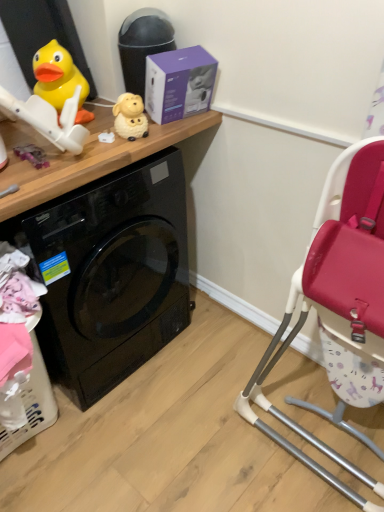
Question: Should I look upward or downward to see white glossy sheep at upper center, the first toy positioned from the right?

Choices:
 (A) up
 (B) down

Answer: (A)

Question: Is rubber duck at upper left, which ranks as the 2th toy in left-to-right order, positioned far away from purple matte box at upper center?

Choices:
 (A) yes
 (B) no

Answer: (B)

Question: From the image's perspective, is rubber duck at upper left, which ranks as the 2th toy in left-to-right order, over purple matte box at upper center?

Choices:
 (A) no
 (B) yes

Answer: (A)

Question: Is rubber duck at upper left, which ranks as the 2th toy in left-to-right order, touching purple matte box at upper center?

Choices:
 (A) no
 (B) yes

Answer: (A)

Question: Is rubber duck at upper left, positioned as the 2th toy in right-to-left order, positioned behind purple matte box at upper center?

Choices:
 (A) no
 (B) yes

Answer: (B)

Question: Could you tell me if rubber duck at upper left, which ranks as the 2th toy in left-to-right order, is facing purple matte box at upper center?

Choices:
 (A) yes
 (B) no

Answer: (B)

Question: Does rubber duck at upper left, positioned as the 2th toy in right-to-left order, have a lesser height compared to purple matte box at upper center?

Choices:
 (A) yes
 (B) no

Answer: (A)

Question: Considering the relative positions of black glossy washing machine at left and white glossy sheep at upper center, the first toy positioned from the right, in the image provided, is black glossy washing machine at left behind white glossy sheep at upper center, the first toy positioned from the right,?

Choices:
 (A) no
 (B) yes

Answer: (A)

Question: From the image's perspective, is black glossy washing machine at left under white glossy sheep at upper center, the third toy viewed from the left?

Choices:
 (A) yes
 (B) no

Answer: (A)

Question: From a real-world perspective, is black glossy washing machine at left over white glossy sheep at upper center, the third toy viewed from the left?

Choices:
 (A) yes
 (B) no

Answer: (B)

Question: Is the position of black glossy washing machine at left less distant than that of white glossy sheep at upper center, the third toy viewed from the left?

Choices:
 (A) no
 (B) yes

Answer: (B)

Question: Is black glossy washing machine at left far away from white glossy sheep at upper center, the third toy viewed from the left?

Choices:
 (A) yes
 (B) no

Answer: (B)

Question: Is black glossy washing machine at left to the left of white glossy sheep at upper center, the third toy viewed from the left, from the viewer's perspective?

Choices:
 (A) no
 (B) yes

Answer: (B)

Question: From a real-world perspective, is purple fabric toy at left, which is the 1th toy in left-to-right order, on top of purple matte box at upper center?

Choices:
 (A) yes
 (B) no

Answer: (B)